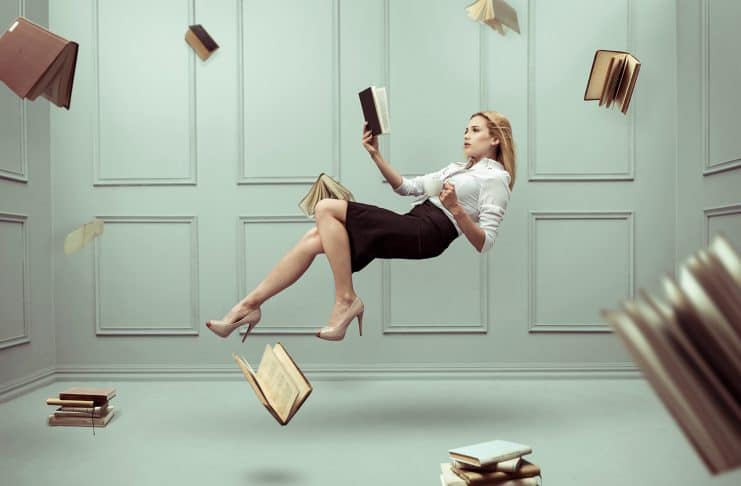
Find the location of a particular element. The width and height of the screenshot is (741, 486). floor is located at coordinates (393, 449).